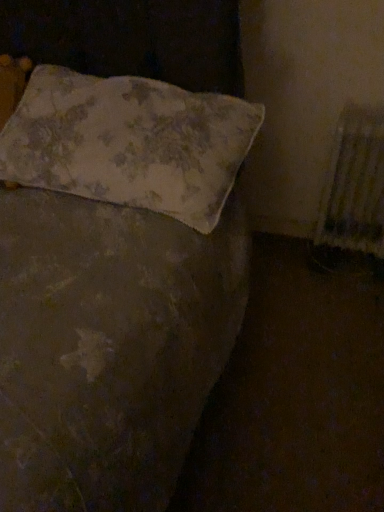
Question: From a real-world perspective, is floral fabric pillow at upper left positioned above or below white textured radiator at right?

Choices:
 (A) below
 (B) above

Answer: (B)

Question: From the image's perspective, is floral fabric pillow at upper left above or below white textured radiator at right?

Choices:
 (A) above
 (B) below

Answer: (A)

Question: Considering the positions of floral fabric pillow at upper left and white textured radiator at right in the image, is floral fabric pillow at upper left taller or shorter than white textured radiator at right?

Choices:
 (A) short
 (B) tall

Answer: (A)

Question: From a real-world perspective, is white textured radiator at right above or below floral fabric pillow at upper left?

Choices:
 (A) below
 (B) above

Answer: (A)

Question: Based on their positions, is white textured radiator at right located to the left or right of floral fabric pillow at upper left?

Choices:
 (A) right
 (B) left

Answer: (A)

Question: Looking at their shapes, would you say white textured radiator at right is wider or thinner than floral fabric pillow at upper left?

Choices:
 (A) thin
 (B) wide

Answer: (A)

Question: Relative to floral fabric pillow at upper left, is white textured radiator at right in front or behind?

Choices:
 (A) front
 (B) behind

Answer: (B)